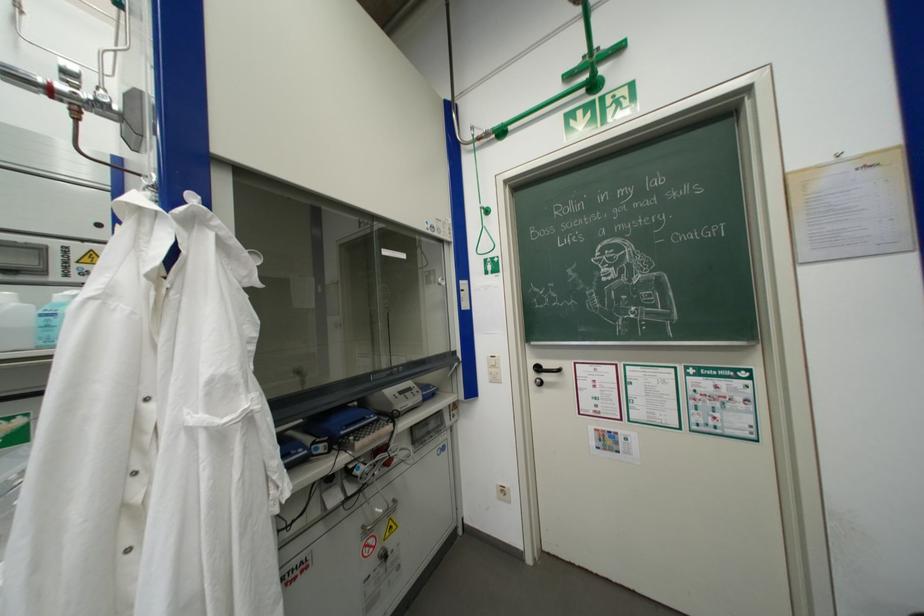
The width and height of the screenshot is (924, 616). I want to click on black door handle, so click(x=542, y=373).